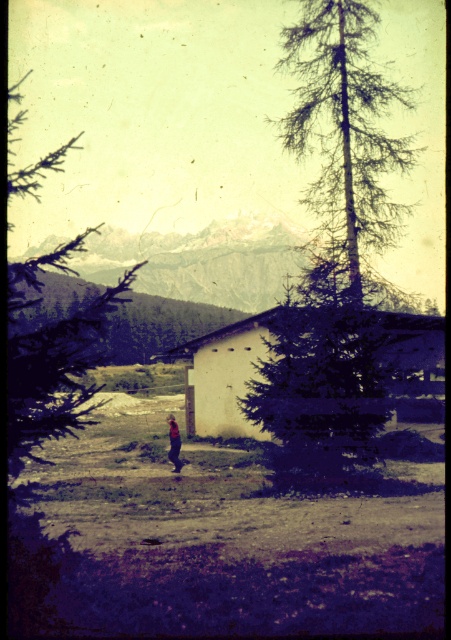
Is point (354, 292) less distant than point (266, 358)?

That is True.

Does point (383, 106) lie behind point (266, 316)?

Yes, it is behind point (266, 316).

This screenshot has width=451, height=640. I want to click on needle-like bark pine at center, so click(x=334, y=248).

Is point (358, 93) positioned after point (70, 324)?

Yes, point (358, 93) is behind point (70, 324).

Can you confirm if needle-like bark pine at center is shorter than green leafy tree at left?

Indeed, needle-like bark pine at center has a lesser height compared to green leafy tree at left.

Is point (363, 140) farther from camera compared to point (82, 321)?

Yes, it is behind point (82, 321).

Find the location of a particular element. Image resolution: width=451 pixels, height=640 pixels. needle-like bark pine at center is located at coordinates (334, 248).

Is point (221, 333) positioned behind point (170, 428)?

Yes, point (221, 333) is farther from viewer.

Is white matte hut at center above dark blue jeans at center?

Indeed, white matte hut at center is positioned over dark blue jeans at center.

Identify the location of white matte hut at center. (224, 376).

Image resolution: width=451 pixels, height=640 pixels. In order to click on white matte hut at center in this screenshot , I will do `click(224, 376)`.